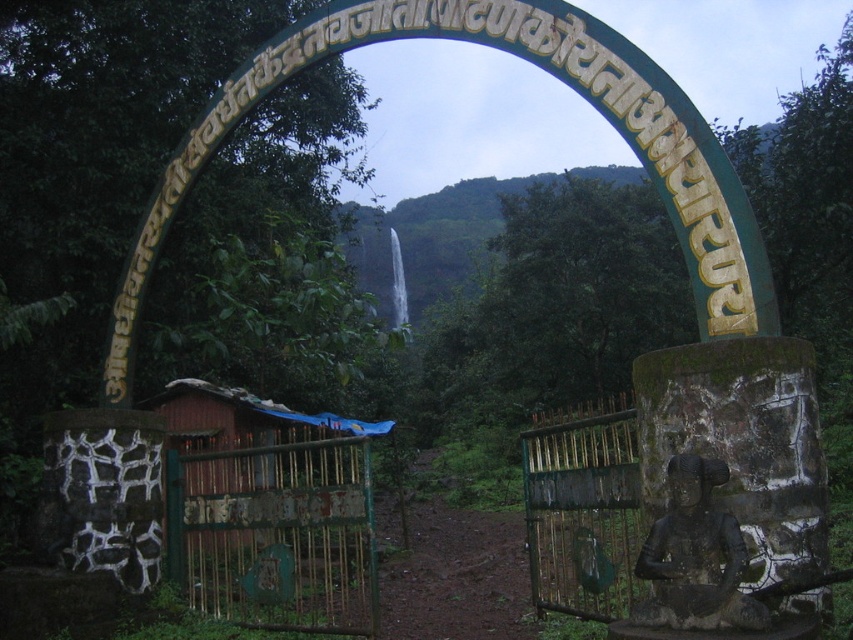
Does point (672, 500) come behind point (339, 429)?

No, (672, 500) is in front of (339, 429).

Can you confirm if black stone statue at lower right is smaller than wooden hut at center?

No, black stone statue at lower right is not smaller than wooden hut at center.

Find the location of a particular element. The width and height of the screenshot is (853, 640). black stone statue at lower right is located at coordinates (695, 557).

Who is more forward, (210,444) or (396,280)?

Positioned in front is point (210,444).

Who is higher up, wooden hut at center or green stone archway at center?

green stone archway at center is above.

Locate an element on the screen. This screenshot has width=853, height=640. wooden hut at center is located at coordinates (242, 419).

What do you see at coordinates (695, 557) in the screenshot? I see `black stone statue at lower right` at bounding box center [695, 557].

Between black stone statue at lower right and green stone archway at center, which one is positioned lower?

black stone statue at lower right is lower down.

The image size is (853, 640). Identify the location of black stone statue at lower right. (695, 557).